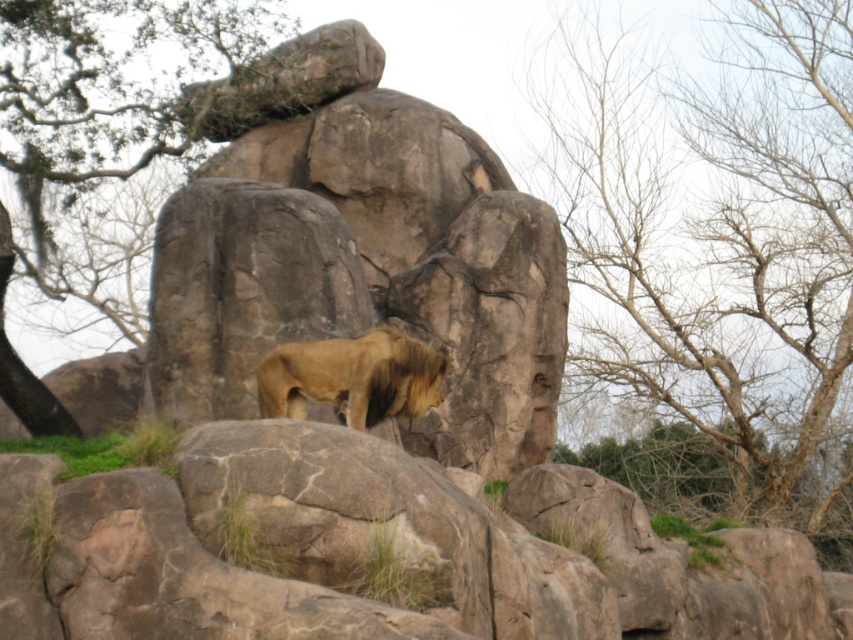
Question: Which is farther from the bare branches at upper right?

Choices:
 (A) green leafy tree at upper left
 (B) golden fur lion at center

Answer: (B)

Question: Is green leafy tree at upper left bigger than golden fur lion at center?

Choices:
 (A) no
 (B) yes

Answer: (B)

Question: Is bare branches at upper right wider than green leafy tree at upper left?

Choices:
 (A) yes
 (B) no

Answer: (B)

Question: Which point is closer to the camera?

Choices:
 (A) (352, 387)
 (B) (38, 132)
 (C) (643, 122)

Answer: (A)

Question: Which object appears farthest from the camera in this image?

Choices:
 (A) bare branches at upper right
 (B) golden fur lion at center

Answer: (A)

Question: Does bare branches at upper right lie behind golden fur lion at center?

Choices:
 (A) yes
 (B) no

Answer: (A)